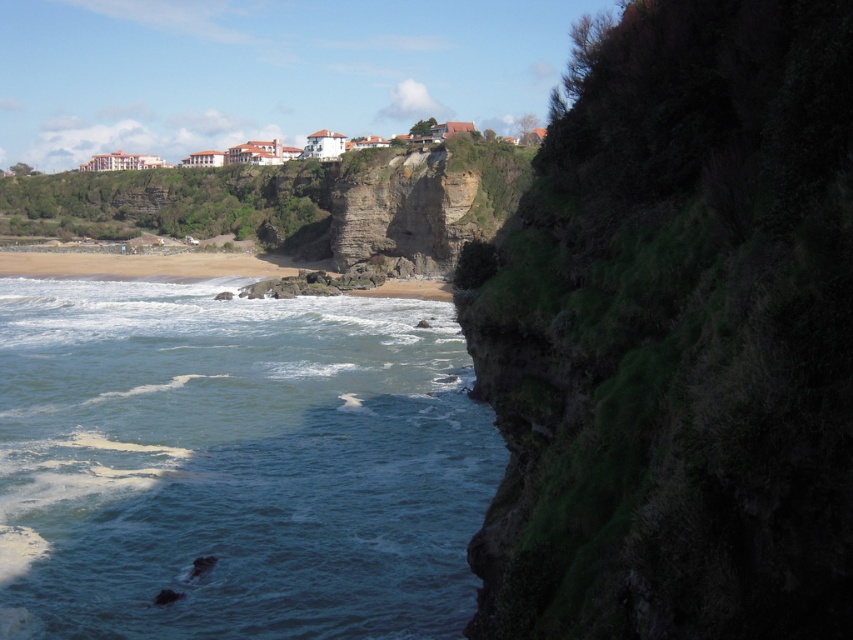
You are standing on the beach and want to climb up to the cliff. You see the green mossy rock at upper center and the blue water at lower left. Which object is closer to the base of the cliff?

The blue water at lower left is closer to the base of the cliff because the green mossy rock at upper center is to the right of it, meaning the blue water is positioned lower and nearer to the cliff base.

You are standing on the cliff and want to look at both the green mossy rock at upper center and the blue water at lower left. Which one will you see first as you look down from the cliff?

You will see the green mossy rock at upper center first because it is closer to the viewer than the blue water at lower left.

You are standing on the cliff overlooking the beach and want to take a photo. There are two points of interest marked in the scene. The first is at point coordinates point (672, 552) and the second at point coordinates point (225, 307). Which point should you focus on to capture the subject that is closer to you?

Point (672, 552) is closer to the camera, so you should focus on that point to capture the subject that is nearer to you.